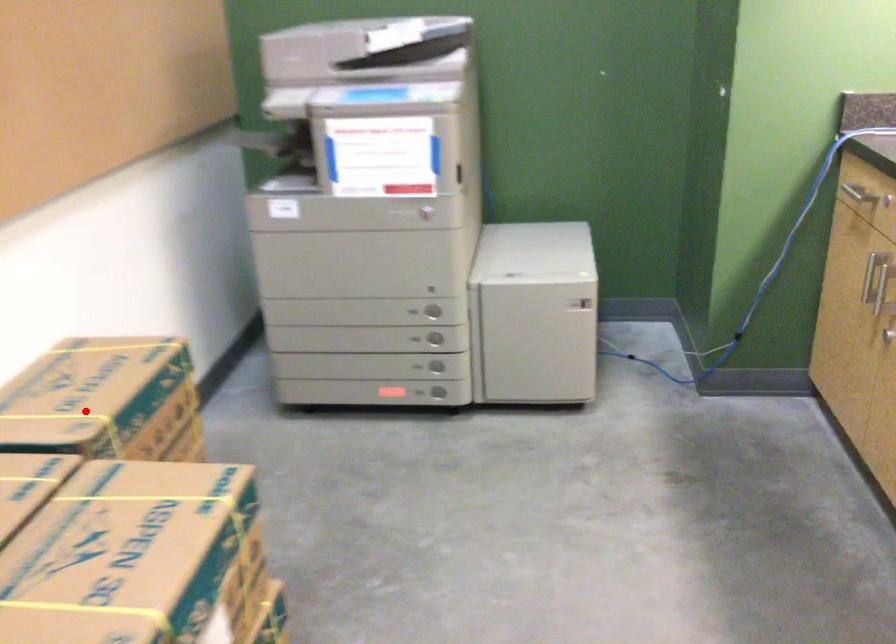
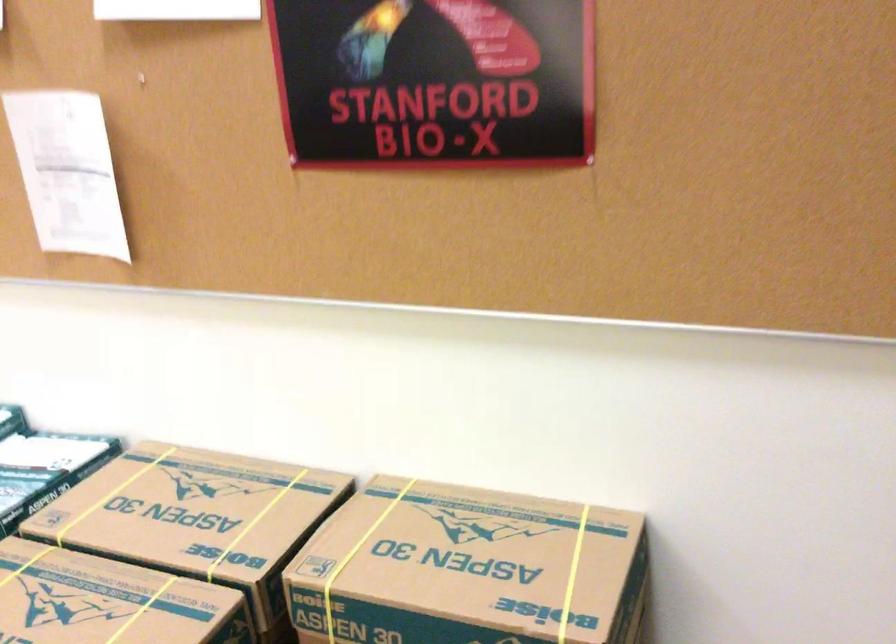
Where in the second image is the point corresponding to the highlighted location from the first image?

(357, 556)